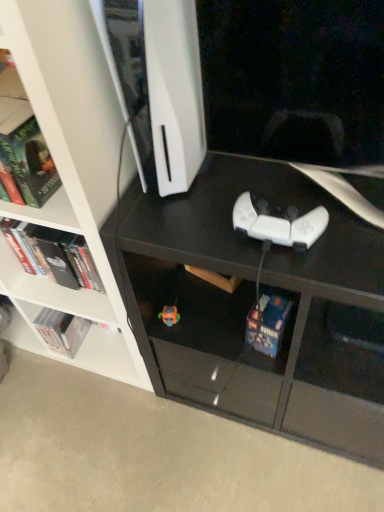
Question: From the image's perspective, is white matte game controller at center above or below translucent orange toy at lower center?

Choices:
 (A) below
 (B) above

Answer: (B)

Question: Is point (248, 226) positioned closer to the camera than point (157, 315)?

Choices:
 (A) closer
 (B) farther

Answer: (A)

Question: Which object is positioned farthest from the green matte bookshelf at upper left?

Choices:
 (A) hardcover book at left, which ranks as the second book in back-to-front order
 (B) translucent orange toy at lower center
 (C) white glossy book at lower left, the 1th book when ordered from left to right
 (D) hardcover book at lower center, which is counted as the third book, starting from the left
 (E) white matte game controller at center

Answer: (C)

Question: Based on their relative distances, which object is farther from the white matte game controller at center?

Choices:
 (A) white glossy book at lower left, the 1th book viewed from the back
 (B) green matte bookshelf at upper left
 (C) white matte bookshelf at upper left
 (D) translucent orange toy at lower center
 (E) hardcover book at left, which is the 2th book from right to left

Answer: (A)